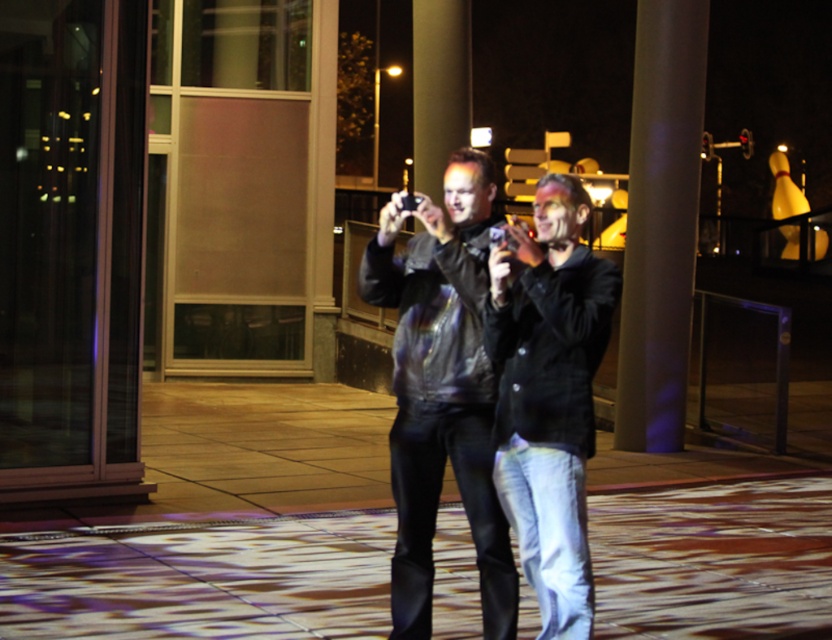
Is point (535, 547) farther from camera compared to point (441, 230)?

No, (535, 547) is in front of (441, 230).

Is denim jeans at center to the right of shiny black jacket at center from the viewer's perspective?

Incorrect, denim jeans at center is not on the right side of shiny black jacket at center.

Which is in front, point (582, 541) or point (461, 157)?

Point (582, 541) is more forward.

You are a GUI agent. You are given a task and a screenshot of the screen. Output one action in this format:
    pyautogui.click(x=<x>, y=<y>)
    Task: Click on the denim jeans at center
    
    Given the screenshot: What is the action you would take?
    pyautogui.click(x=548, y=394)